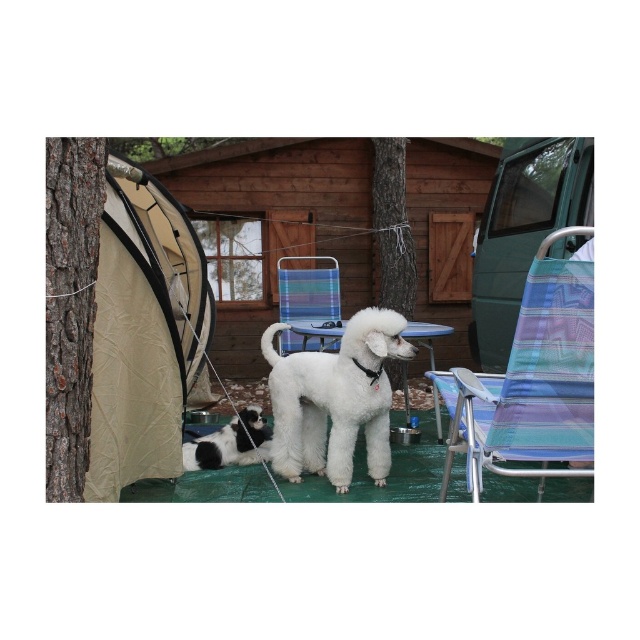
Who is more distant from viewer, (332, 483) or (198, 438)?

Point (198, 438)

Who is lower down, white fluffy dog at center or black-and-white fur at lower center?

black-and-white fur at lower center is below.

Is point (332, 445) more distant than point (268, 458)?

No, (332, 445) is in front of (268, 458).

At what (x,y) coordinates should I click in order to perform the action: click on white fluffy dog at center. Please return your answer as a coordinate pair (x, y). Looking at the image, I should click on (333, 400).

Can you confirm if brown rough tree trunk at left is positioned above black-and-white fur at lower center?

Correct, brown rough tree trunk at left is located above black-and-white fur at lower center.

Is brown rough tree trunk at left positioned behind black-and-white fur at lower center?

No, brown rough tree trunk at left is in front of black-and-white fur at lower center.

Who is more forward, (99,243) or (237,436)?

Point (99,243) is more forward.

The height and width of the screenshot is (640, 640). What are the coordinates of `brown rough tree trunk at left` in the screenshot? It's located at [70, 305].

Which is in front, point (177, 381) or point (196, 461)?

Point (177, 381) is in front.

Find the location of a particular element. The height and width of the screenshot is (640, 640). beige fabric tent at left is located at coordinates click(x=144, y=332).